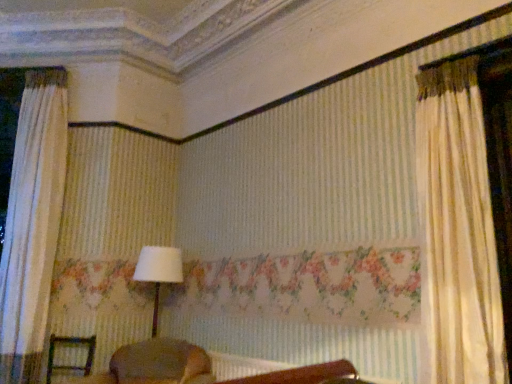
Question: Is white fabric lampshade at center to the left of wooden chair at lower left from the viewer's perspective?

Choices:
 (A) no
 (B) yes

Answer: (A)

Question: Can you see white fabric lampshade at center touching wooden chair at lower left?

Choices:
 (A) yes
 (B) no

Answer: (B)

Question: Is white fabric lampshade at center shorter than wooden chair at lower left?

Choices:
 (A) yes
 (B) no

Answer: (B)

Question: Is wooden chair at lower left surrounded by white fabric lampshade at center?

Choices:
 (A) no
 (B) yes

Answer: (A)

Question: Does white fabric lampshade at center lie in front of wooden chair at lower left?

Choices:
 (A) no
 (B) yes

Answer: (A)

Question: Would you say white fabric lampshade at center is a long distance from wooden chair at lower left?

Choices:
 (A) yes
 (B) no

Answer: (B)

Question: Can you confirm if wooden chair at lower left is positioned to the left of white fabric lampshade at center?

Choices:
 (A) no
 (B) yes

Answer: (B)

Question: Is wooden chair at lower left to the right of white fabric lampshade at center from the viewer's perspective?

Choices:
 (A) no
 (B) yes

Answer: (A)

Question: Is wooden chair at lower left taller than white fabric lampshade at center?

Choices:
 (A) no
 (B) yes

Answer: (A)

Question: Is wooden chair at lower left far from white fabric lampshade at center?

Choices:
 (A) yes
 (B) no

Answer: (B)

Question: Does wooden chair at lower left come in front of white fabric lampshade at center?

Choices:
 (A) no
 (B) yes

Answer: (B)

Question: Is wooden chair at lower left placed right next to white fabric lampshade at center?

Choices:
 (A) no
 (B) yes

Answer: (A)

Question: From a real-world perspective, is wooden chair at lower left physically located above or below white fabric lampshade at center?

Choices:
 (A) below
 (B) above

Answer: (A)